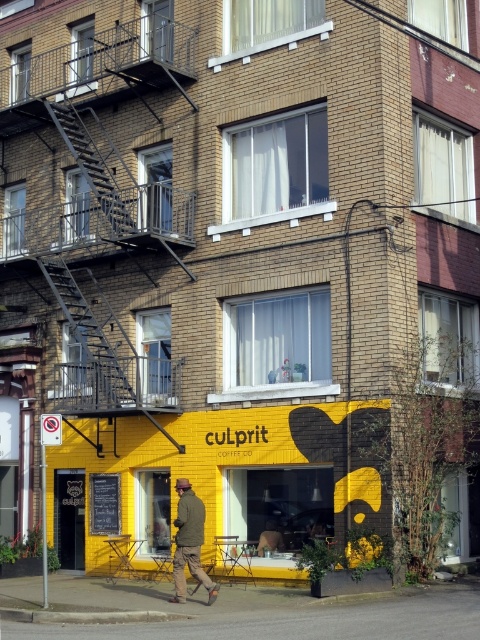
Question: Is black metal fire escape at upper left closer to camera compared to camouflage jacket at center?

Choices:
 (A) yes
 (B) no

Answer: (B)

Question: Is black metal fire escape at upper left further to the viewer compared to camouflage jacket at center?

Choices:
 (A) no
 (B) yes

Answer: (B)

Question: Among these objects, which one is nearest to the camera?

Choices:
 (A) black metal fire escape at upper left
 (B) gray asphalt pavement at lower center

Answer: (B)

Question: Can you confirm if black metal fire escape at upper left is positioned below gray asphalt pavement at lower center?

Choices:
 (A) no
 (B) yes

Answer: (A)

Question: Which is farther from the gray asphalt pavement at lower center?

Choices:
 (A) black metal fire escape at upper left
 (B) camouflage jacket at center

Answer: (A)

Question: Which object is closer to the camera taking this photo?

Choices:
 (A) black metal fire escape at upper left
 (B) camouflage jacket at center

Answer: (B)